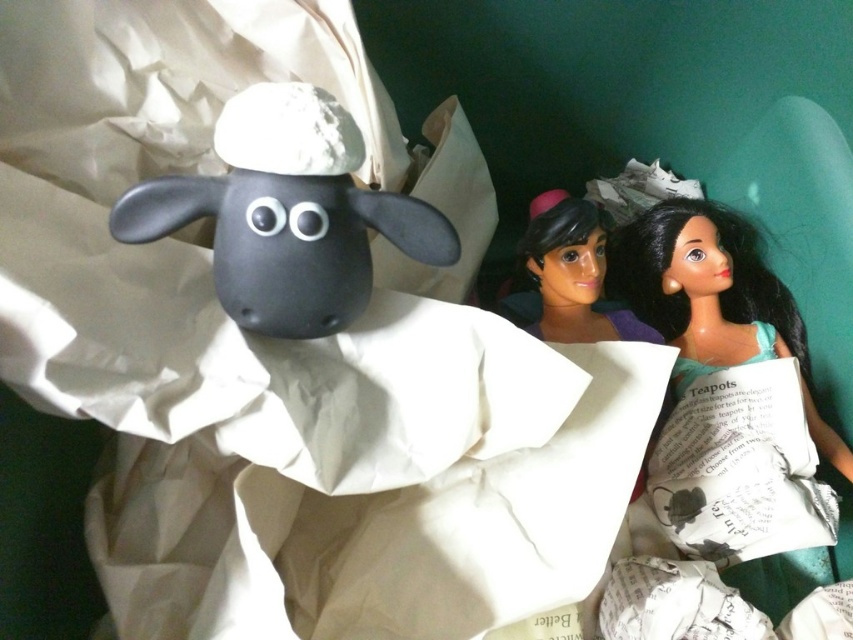
In the scene shown: Does smooth plastic doll at right have a greater height compared to smooth plastic doll at center?

Correct, smooth plastic doll at right is much taller as smooth plastic doll at center.

Between point (730, 323) and point (589, 330), which one is positioned in front?

Point (589, 330) is in front.

Identify the location of smooth plastic doll at right. This screenshot has width=853, height=640. point(714,298).

Is matte black sheep at center taller than smooth plastic doll at center?

No, matte black sheep at center is not taller than smooth plastic doll at center.

From the picture: Does matte black sheep at center appear over smooth plastic doll at center?

Indeed, matte black sheep at center is positioned over smooth plastic doll at center.

Is point (270, 202) positioned in front of point (579, 273)?

Yes, point (270, 202) is closer to viewer.

Locate an element on the screen. matte black sheep at center is located at coordinates (287, 212).

Is matte black sheep at center thinner than smooth plastic doll at right?

No.

The height and width of the screenshot is (640, 853). I want to click on matte black sheep at center, so click(x=287, y=212).

Image resolution: width=853 pixels, height=640 pixels. What do you see at coordinates (287, 212) in the screenshot?
I see `matte black sheep at center` at bounding box center [287, 212].

Where is `matte black sheep at center`? The width and height of the screenshot is (853, 640). matte black sheep at center is located at coordinates (287, 212).